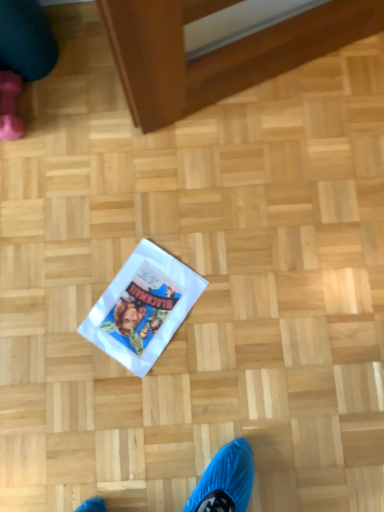
In order to click on vacant space in front of pink rubber boot at upper left in this screenshot , I will do coord(38,173).